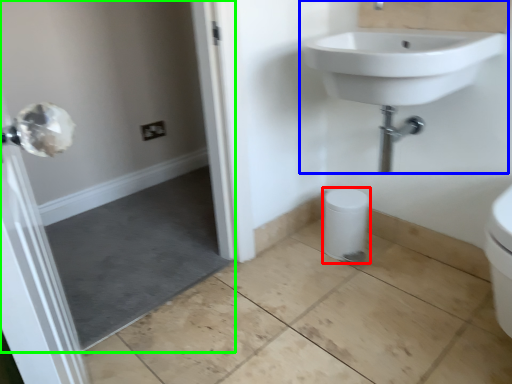
Question: Estimate the real-world distances between objects in this image. Which object is closer to bidet (highlighted by a red box), sink (highlighted by a blue box) or screen door (highlighted by a green box)?

Choices:
 (A) sink
 (B) screen door

Answer: (A)